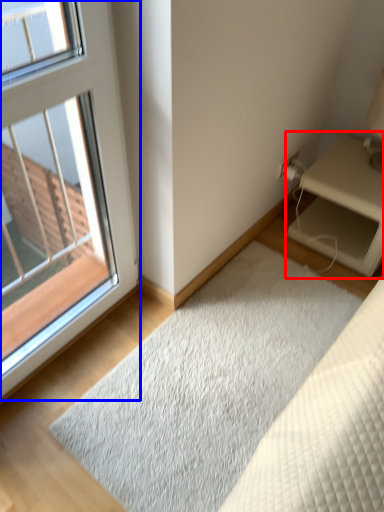
Question: Which object appears farthest to the camera in this image, nightstand (highlighted by a red box) or window (highlighted by a blue box)?

Choices:
 (A) nightstand
 (B) window

Answer: (A)